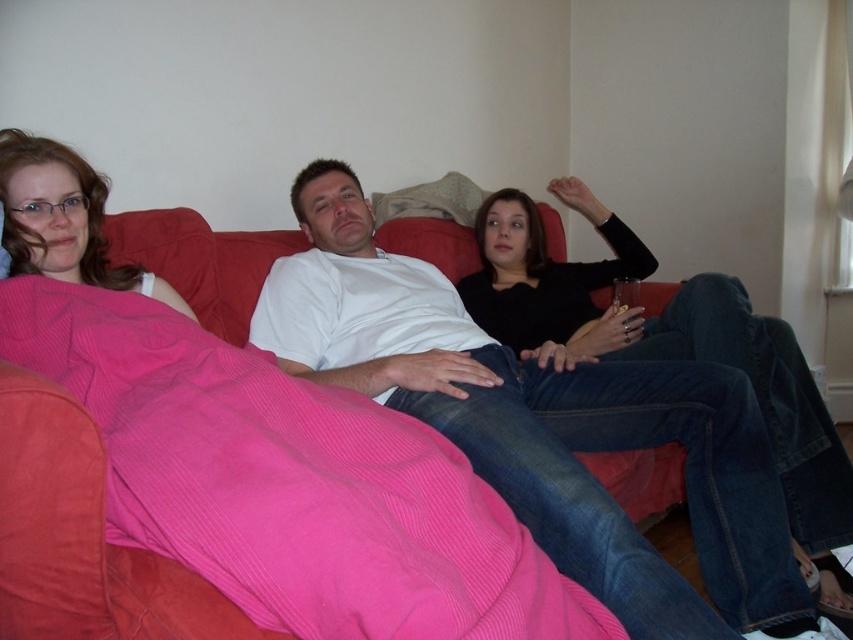
Does point (123, 330) lie in front of point (555, 465)?

Yes, point (123, 330) is in front of point (555, 465).

Consider the image. Is pink corduroy blanket at upper left shorter than white cotton shirt at center?

Indeed, pink corduroy blanket at upper left has a lesser height compared to white cotton shirt at center.

What do you see at coordinates (260, 451) in the screenshot?
I see `pink corduroy blanket at upper left` at bounding box center [260, 451].

At what (x,y) coordinates should I click in order to perform the action: click on pink corduroy blanket at upper left. Please return your answer as a coordinate pair (x, y). Looking at the image, I should click on (260, 451).